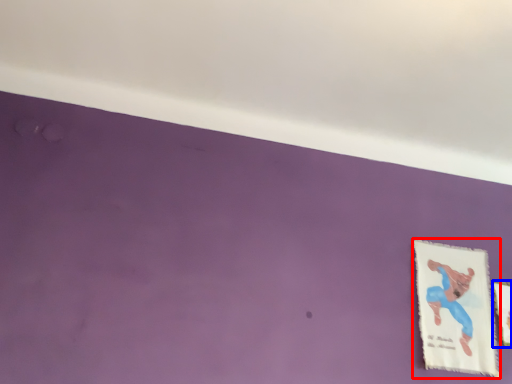
Question: Which point is closer to the camera, picture frame (highlighted by a red box) or picture frame (highlighted by a blue box)?

Choices:
 (A) picture frame
 (B) picture frame

Answer: (A)